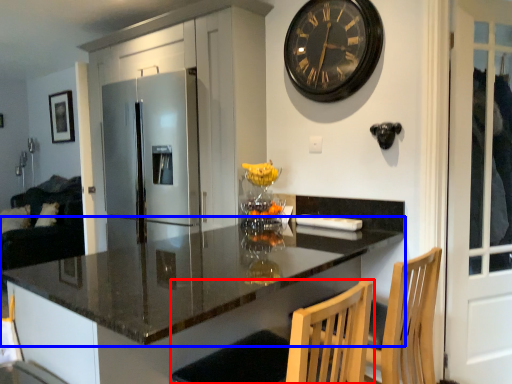
Question: Among these objects, which one is nearest to the camera, swivel chair (highlighted by a red box) or countertop (highlighted by a blue box)?

Choices:
 (A) swivel chair
 (B) countertop

Answer: (B)